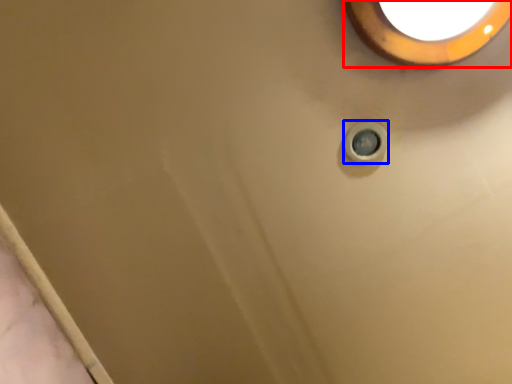
Question: Which point is closer to the camera, lighting (highlighted by a red box) or knob (highlighted by a blue box)?

Choices:
 (A) lighting
 (B) knob

Answer: (A)